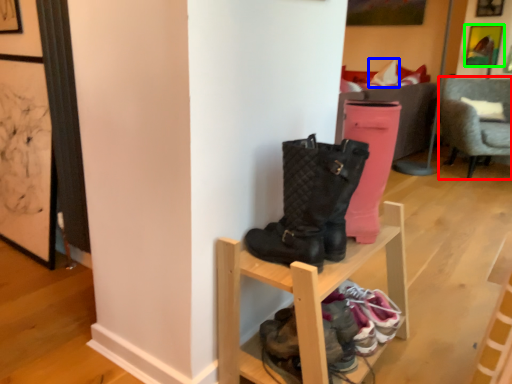
Question: Based on their relative distances, which object is farther from chair (highlighted by a red box)? Choose from pillow (highlighted by a blue box) and picture frame (highlighted by a green box).

Choices:
 (A) pillow
 (B) picture frame

Answer: (B)